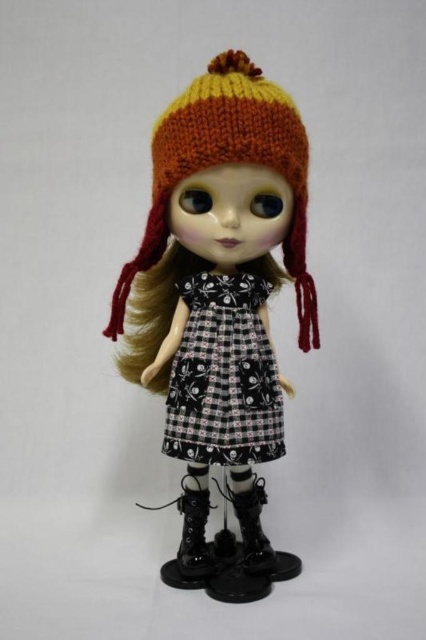
Question: Among these objects, which one is nearest to the camera?

Choices:
 (A) black leather boot at lower center
 (B) knitted woolen hat at center

Answer: (B)

Question: Which point is closer to the camera?

Choices:
 (A) knitted woolen hat at center
 (B) black printed fabric dress at center
 (C) black leather boot at lower center

Answer: (A)

Question: Is knitted woolen hat at center above black printed fabric dress at center?

Choices:
 (A) no
 (B) yes

Answer: (B)

Question: Is knitted woolen hat at center thinner than black leather boot at lower center?

Choices:
 (A) yes
 (B) no

Answer: (B)

Question: Which point appears farthest from the camera in this image?

Choices:
 (A) (239, 304)
 (B) (196, 563)
 (C) (198, 472)

Answer: (C)

Question: Is knitted woolen hat at center above black leather boot at lower center?

Choices:
 (A) yes
 (B) no

Answer: (A)